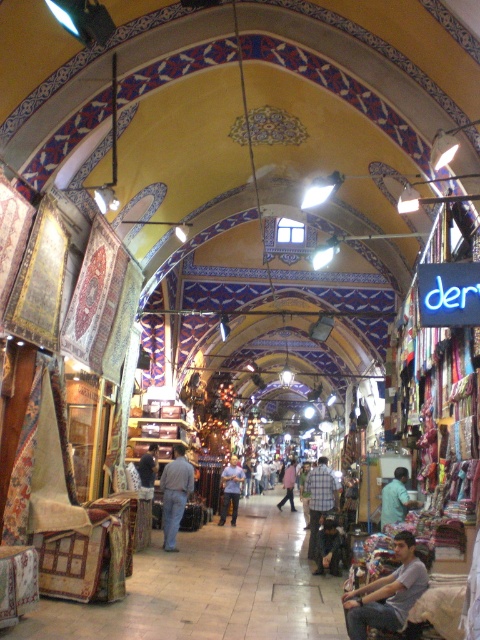
You are a customer in this market and want to buy both the light blue fabric at center and the light blue shirt at center. However, you have a limited budget and can only afford one item. Which item is closer to you so you can grab it quickly?

The light blue fabric at center is 148.53 feet away from the light blue shirt at center. Since you can only afford one item and want to grab it quickly, you should choose the one closer to you. However, the description does not specify which item is closer, so I cannot determine which one to grab.

You are standing in the market and want to move from point A to point B. Point A is at coordinates point (312,470) and point B is at coordinates point (342,534). Which point is closer to you when you are facing the market stalls?

Point A at coordinates point (312,470) is closer to you because it is further to the viewer than point B at coordinates point (342,534).

You are a customer browsing the market and want to hang both the plaid shirt at center and the dark brown leather jacket at center on a single hanger. The hanger can only hold items up to the height of the shorter object. Which item determines the maximum height the hanger must accommodate?

The plaid shirt at center has a greater height compared to the dark brown leather jacket at center, so the hanger must accommodate the height of the plaid shirt at center to hold both items.